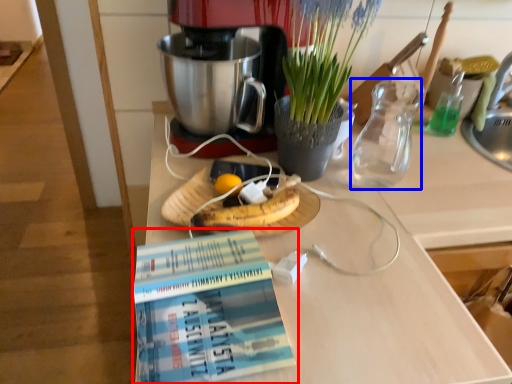
Question: Which point is closer to the camera, book (highlighted by a red box) or tea pot (highlighted by a blue box)?

Choices:
 (A) book
 (B) tea pot

Answer: (A)